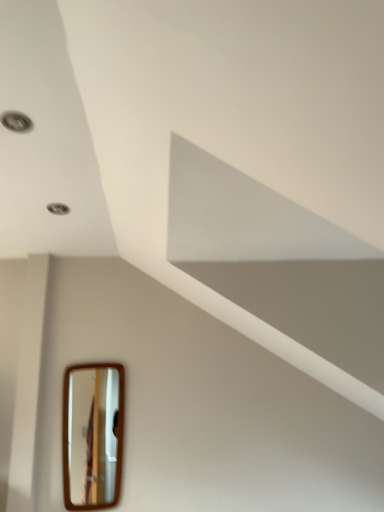
Question: From the image's perspective, is matte silver droplight at upper left positioned above or below wooden-framed mirror at lower left?

Choices:
 (A) below
 (B) above

Answer: (B)

Question: From a real-world perspective, is matte silver droplight at upper left physically located above or below wooden-framed mirror at lower left?

Choices:
 (A) above
 (B) below

Answer: (A)

Question: Is matte silver droplight at upper left in front of or behind wooden-framed mirror at lower left in the image?

Choices:
 (A) front
 (B) behind

Answer: (A)

Question: From a real-world perspective, is wooden-framed mirror at lower left above or below matte silver droplight at upper left?

Choices:
 (A) below
 (B) above

Answer: (A)

Question: From the image's perspective, relative to matte silver droplight at upper left, is wooden-framed mirror at lower left above or below?

Choices:
 (A) below
 (B) above

Answer: (A)

Question: Considering the positions of wooden-framed mirror at lower left and matte silver droplight at upper left in the image, is wooden-framed mirror at lower left wider or thinner than matte silver droplight at upper left?

Choices:
 (A) thin
 (B) wide

Answer: (A)

Question: In terms of height, does wooden-framed mirror at lower left look taller or shorter compared to matte silver droplight at upper left?

Choices:
 (A) tall
 (B) short

Answer: (A)